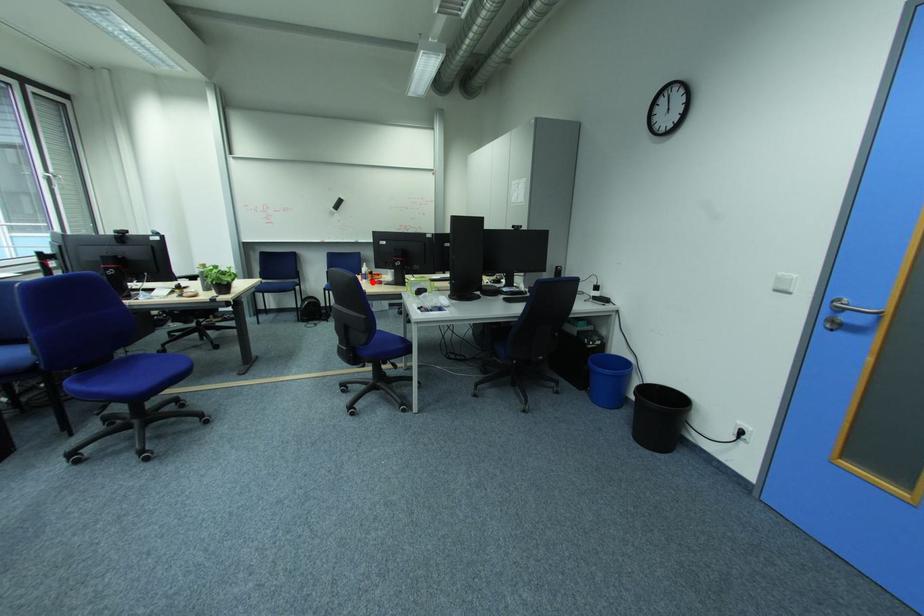
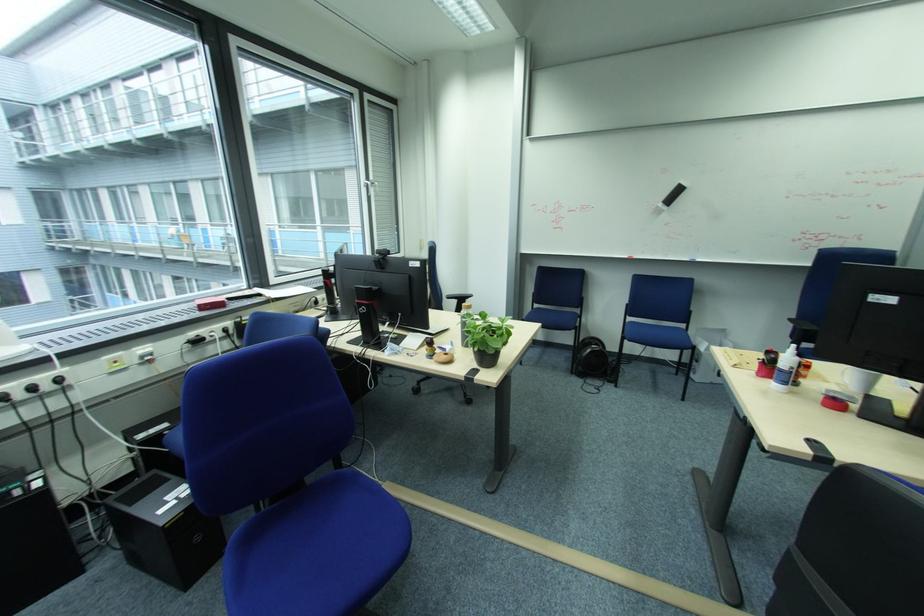
Where in the second image is the point corresponding to the highlighted location from the first image?

(784, 387)